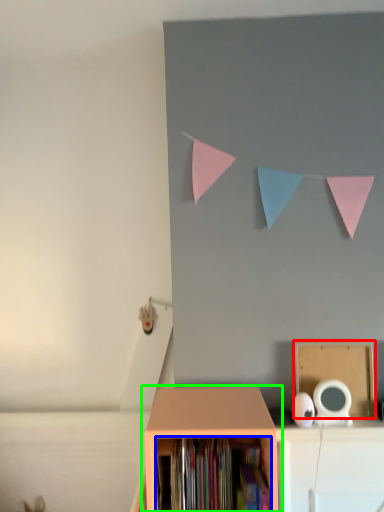
Question: Based on their relative distances, which object is nearer to cardboard box (highlighted by a red box)? Choose from book (highlighted by a blue box) and shelf (highlighted by a green box).

Choices:
 (A) book
 (B) shelf

Answer: (B)